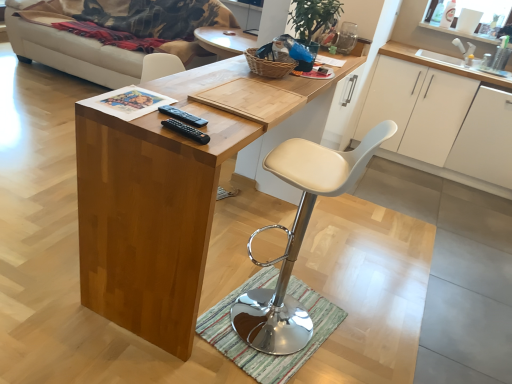
Where is `vacant area located to the right-hand side of striped fabric doormat at lower center`? This screenshot has width=512, height=384. vacant area located to the right-hand side of striped fabric doormat at lower center is located at coordinates (372, 340).